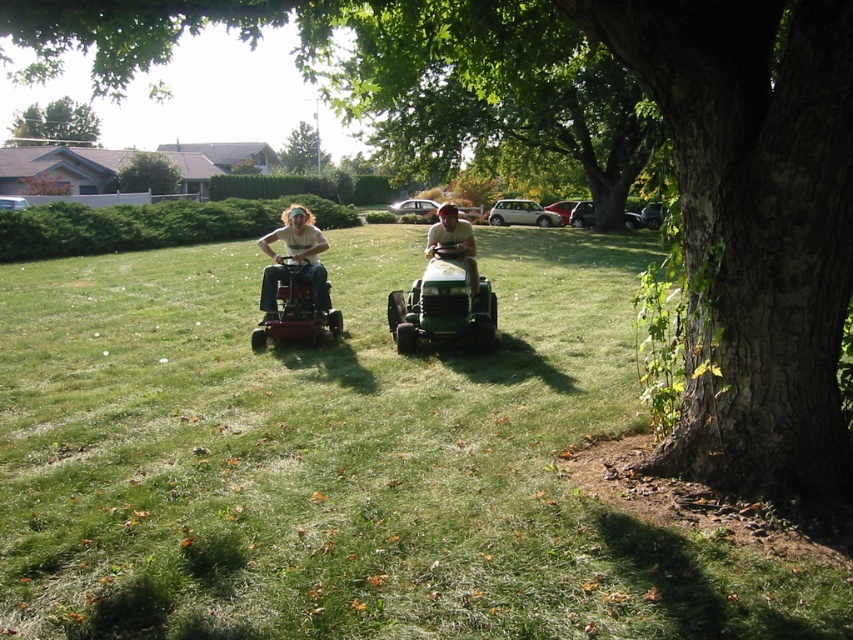
Which is in front, point (614, 522) or point (22, 129)?

Point (614, 522)

Between green grass at center and green leafy tree at upper left, which one has less height?

With less height is green grass at center.

What do you see at coordinates (344, 460) in the screenshot? I see `green grass at center` at bounding box center [344, 460].

Find the location of a particular element. green grass at center is located at coordinates (344, 460).

Is green grass at center in front of green leafy tree at upper center?

Yes.

Who is positioned more to the right, green grass at center or green leafy tree at upper center?

green grass at center

Is point (33, 474) positioned in front of point (132, 163)?

Yes, it is.

At what (x,y) coordinates should I click in order to perform the action: click on green grass at center. Please return your answer as a coordinate pair (x, y). Looking at the image, I should click on (344, 460).

Looking at this image, is green plastic lawn mower at center thinner than green leafy tree at center?

Yes.

Between green plastic lawn mower at center and green leafy tree at center, which one appears on the left side from the viewer's perspective?

Positioned to the left is green leafy tree at center.

Describe the element at coordinates (456, 244) in the screenshot. I see `green plastic lawn mower at center` at that location.

At what (x,y) coordinates should I click in order to perform the action: click on green plastic lawn mower at center. Please return your answer as a coordinate pair (x, y). The height and width of the screenshot is (640, 853). Looking at the image, I should click on (456, 244).